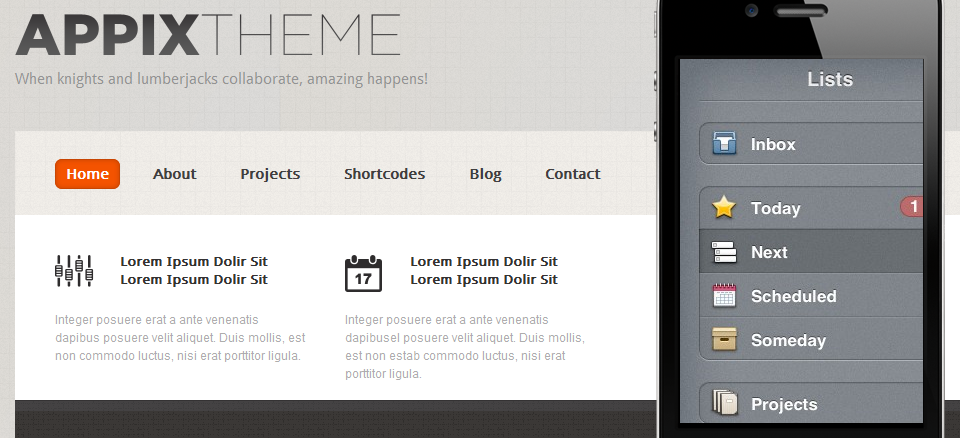
At what (x,y) coordinates should I click in order to perform the action: click on calendar. Please return your answer as a coordinate pair (x, y). Looking at the image, I should click on (727, 295).